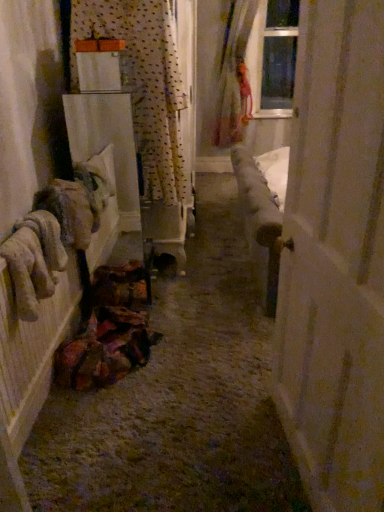
Question: Looking at their shapes, would you say fuzzy beige gloves at left is wider or thinner than white matte door at right?

Choices:
 (A) wide
 (B) thin

Answer: (A)

Question: From a real-world perspective, is fuzzy beige gloves at left above or below white matte door at right?

Choices:
 (A) above
 (B) below

Answer: (B)

Question: Which is nearer to the fuzzy beige gloves at left?

Choices:
 (A) translucent fabric curtain at upper right, which is the first curtain in top-to-bottom order
 (B) textured fabric bag at lower left
 (C) polka dot fabric curtain at upper left, the 1th curtain in the bottom-to-top sequence
 (D) white matte door at right

Answer: (B)

Question: Based on their relative distances, which object is nearer to the fuzzy beige gloves at left?

Choices:
 (A) translucent fabric curtain at upper right, which is counted as the second curtain, starting from the left
 (B) polka dot fabric curtain at upper left, which is the second curtain in right-to-left order
 (C) white matte door at right
 (D) textured fabric bag at lower left

Answer: (D)